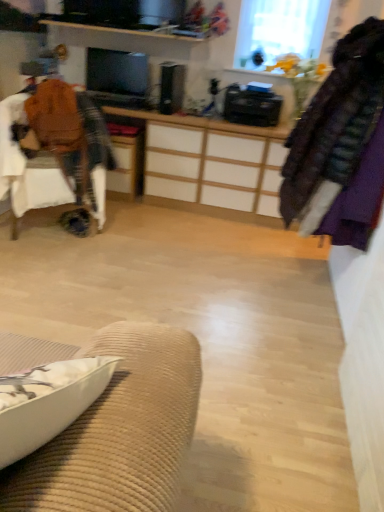
Question: Considering the relative sizes of matte black monitor at center and transparent glass window at upper center in the image provided, is matte black monitor at center taller than transparent glass window at upper center?

Choices:
 (A) yes
 (B) no

Answer: (B)

Question: Can you confirm if matte black monitor at center is smaller than transparent glass window at upper center?

Choices:
 (A) no
 (B) yes

Answer: (B)

Question: Is matte black monitor at center thinner than transparent glass window at upper center?

Choices:
 (A) no
 (B) yes

Answer: (B)

Question: From a real-world perspective, is matte black monitor at center below transparent glass window at upper center?

Choices:
 (A) no
 (B) yes

Answer: (B)

Question: From the image's perspective, does matte black monitor at center appear higher than transparent glass window at upper center?

Choices:
 (A) no
 (B) yes

Answer: (A)

Question: From the image's perspective, is matte black monitor at center under transparent glass window at upper center?

Choices:
 (A) no
 (B) yes

Answer: (B)

Question: From a real-world perspective, is velvet purple coat at right positioned under white fabric cushion at lower left based on gravity?

Choices:
 (A) yes
 (B) no

Answer: (B)

Question: Is velvet purple coat at right at the right side of white fabric cushion at lower left?

Choices:
 (A) yes
 (B) no

Answer: (A)

Question: Can you confirm if velvet purple coat at right is taller than white fabric cushion at lower left?

Choices:
 (A) no
 (B) yes

Answer: (B)

Question: Is white fabric cushion at lower left at the back of velvet purple coat at right?

Choices:
 (A) no
 (B) yes

Answer: (A)

Question: Does velvet purple coat at right have a larger size compared to white fabric cushion at lower left?

Choices:
 (A) no
 (B) yes

Answer: (B)

Question: Is velvet purple coat at right oriented towards white fabric cushion at lower left?

Choices:
 (A) no
 (B) yes

Answer: (A)

Question: Does velvet purple coat at right have a lesser height compared to brown fabric chair at left?

Choices:
 (A) yes
 (B) no

Answer: (B)